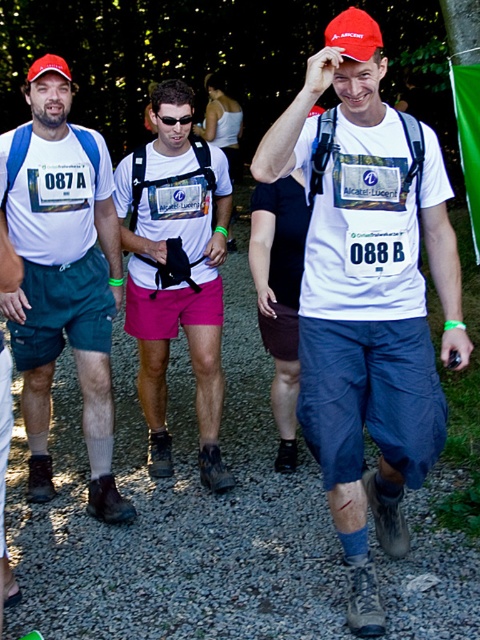
Can you confirm if matte blue shorts at left is taller than pink fabric shorts at center?

Yes.

Identify the location of matte blue shorts at left. (62, 275).

Who is positioned more to the left, white matte t-shirt at center or matte blue shorts at left?

Positioned to the left is matte blue shorts at left.

Can you confirm if white matte t-shirt at center is positioned above matte blue shorts at left?

Actually, white matte t-shirt at center is below matte blue shorts at left.

Measure the distance between white matte t-shirt at center and camera.

They are 2.00 meters apart.

Locate an element on the screen. This screenshot has height=640, width=480. white matte t-shirt at center is located at coordinates (368, 294).

Can you confirm if white matte t-shirt at center is smaller than pink fabric shorts at center?

Actually, white matte t-shirt at center might be larger than pink fabric shorts at center.

Is point (272, 156) positioned in front of point (158, 403)?

Yes, it is in front of point (158, 403).

Identify the location of white matte t-shirt at center. (368, 294).